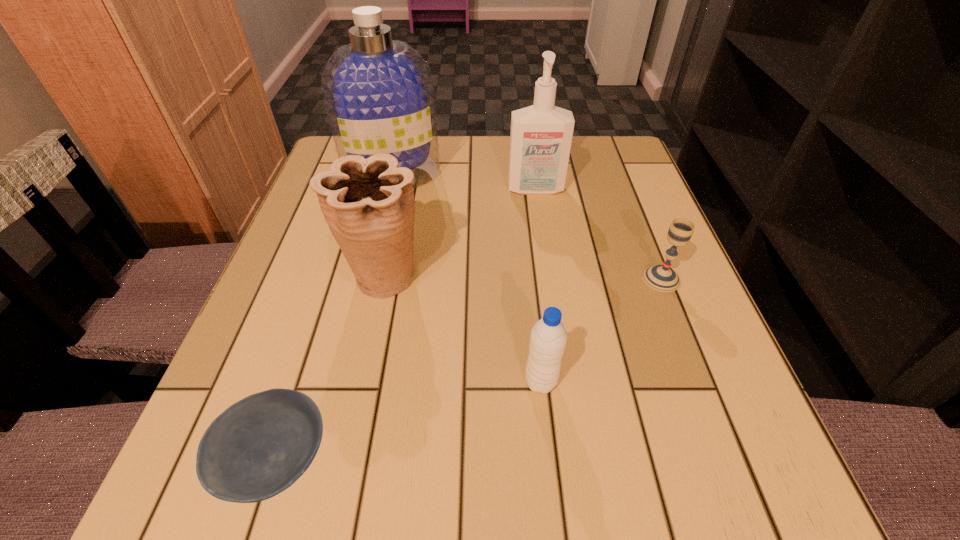
Find the location of a particular element. Image resolution: width=960 pixels, height=540 pixels. bowl that is positioned at the left edge is located at coordinates (258, 447).

You are a GUI agent. You are given a task and a screenshot of the screen. Output one action in this format:
    pyautogui.click(x=<x>, y=<y>)
    Task: Click on the object at the right edge
    The image size is (960, 540).
    Given the screenshot: What is the action you would take?
    pyautogui.click(x=662, y=278)

This screenshot has width=960, height=540. In order to click on object at the far left corner in this screenshot , I will do `click(378, 92)`.

Find the location of `object located in the near left corner section of the desktop`. object located in the near left corner section of the desktop is located at coordinates (258, 447).

Locate an element on the screen. The width and height of the screenshot is (960, 540). vacant space at the far edge is located at coordinates (462, 176).

Find the location of `vacant region at the near edge of the desktop`. vacant region at the near edge of the desktop is located at coordinates (574, 462).

Where is `vacant area at the left edge`? The width and height of the screenshot is (960, 540). vacant area at the left edge is located at coordinates (318, 238).

Where is `vacant region at the right edge of the desktop`? The width and height of the screenshot is (960, 540). vacant region at the right edge of the desktop is located at coordinates (617, 278).

At what (x,y) coordinates should I click in order to perform the action: click on vacant space at the far right corner. Please return your answer as a coordinate pair (x, y). This screenshot has width=960, height=540. Looking at the image, I should click on (577, 154).

The height and width of the screenshot is (540, 960). Identify the location of vacant area that lies between the urn and the shorter cleansing agent. (459, 233).